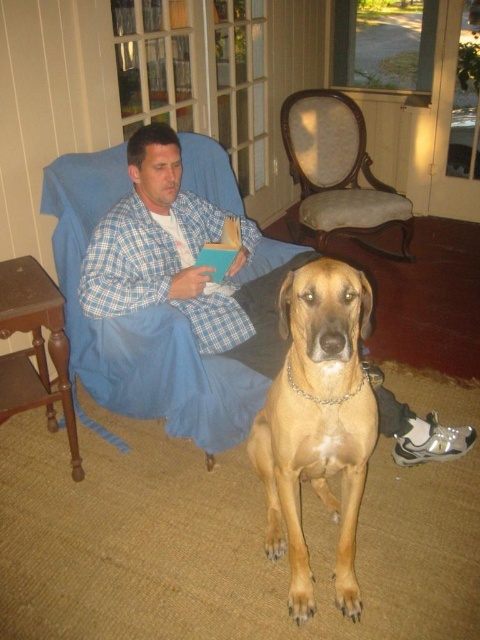
Question: Does golden fur dog at center come in front of light brown fabric armchair at upper center?

Choices:
 (A) yes
 (B) no

Answer: (A)

Question: From the image, what is the correct spatial relationship of golden fur dog at center in relation to light brown fabric armchair at upper center?

Choices:
 (A) above
 (B) below

Answer: (B)

Question: Which of the following is the closest to the observer?

Choices:
 (A) light brown fabric armchair at upper center
 (B) plaid pajama at center
 (C) golden fur dog at center

Answer: (C)

Question: Which point is closer to the camera?

Choices:
 (A) (316, 216)
 (B) (267, 534)

Answer: (B)

Question: Which object is farther from the camera taking this photo?

Choices:
 (A) light brown fabric armchair at upper center
 (B) golden fur dog at center

Answer: (A)

Question: Is golden fur dog at center smaller than light brown fabric armchair at upper center?

Choices:
 (A) yes
 (B) no

Answer: (A)